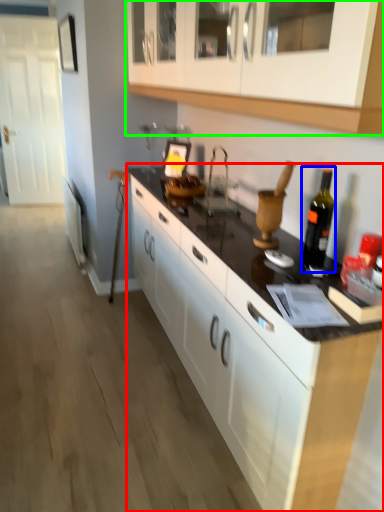
Question: Estimate the real-world distances between objects in this image. Which object is farther from countertop (highlighted by a red box), bottle (highlighted by a blue box) or cabinetry (highlighted by a green box)?

Choices:
 (A) bottle
 (B) cabinetry

Answer: (B)